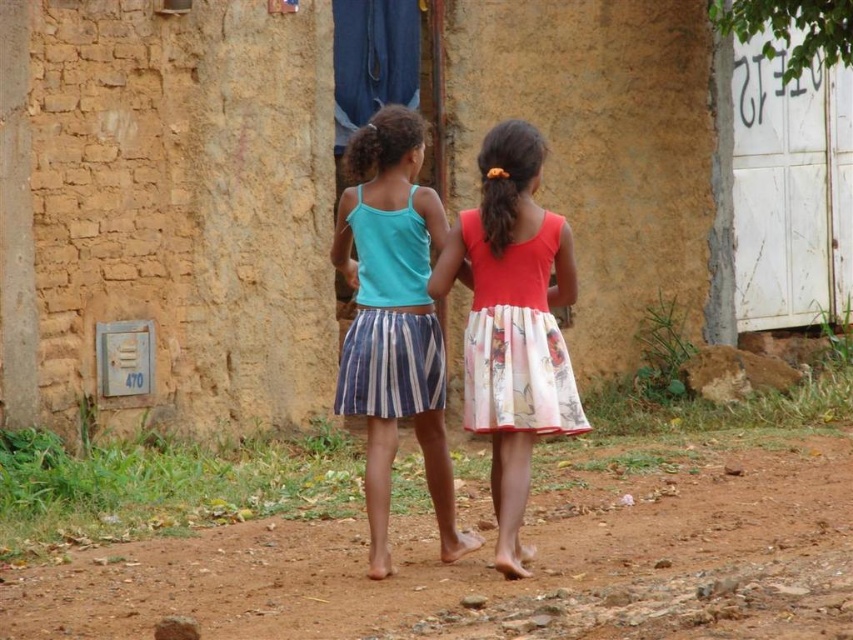
Question: Can you confirm if brown dirt track at lower center is positioned to the right of striped cotton skirt at center?

Choices:
 (A) no
 (B) yes

Answer: (A)

Question: Does striped cotton skirt at center come in front of floral cotton dress at center?

Choices:
 (A) yes
 (B) no

Answer: (B)

Question: Which of the following is the farthest from the observer?

Choices:
 (A) (381, 387)
 (B) (383, 360)
 (C) (566, 256)
 (D) (502, 401)

Answer: (B)

Question: Among these objects, which one is nearest to the camera?

Choices:
 (A) striped cotton dress at center
 (B) floral cotton dress at center
 (C) brown dirt track at lower center

Answer: (C)

Question: Based on their relative distances, which object is farther from the striped cotton dress at center?

Choices:
 (A) matte pink dress at center
 (B) striped cotton skirt at center
 (C) brown dirt track at lower center
 (D) floral cotton dress at center

Answer: (C)

Question: Can you confirm if brown dirt track at lower center is positioned below matte pink dress at center?

Choices:
 (A) yes
 (B) no

Answer: (A)